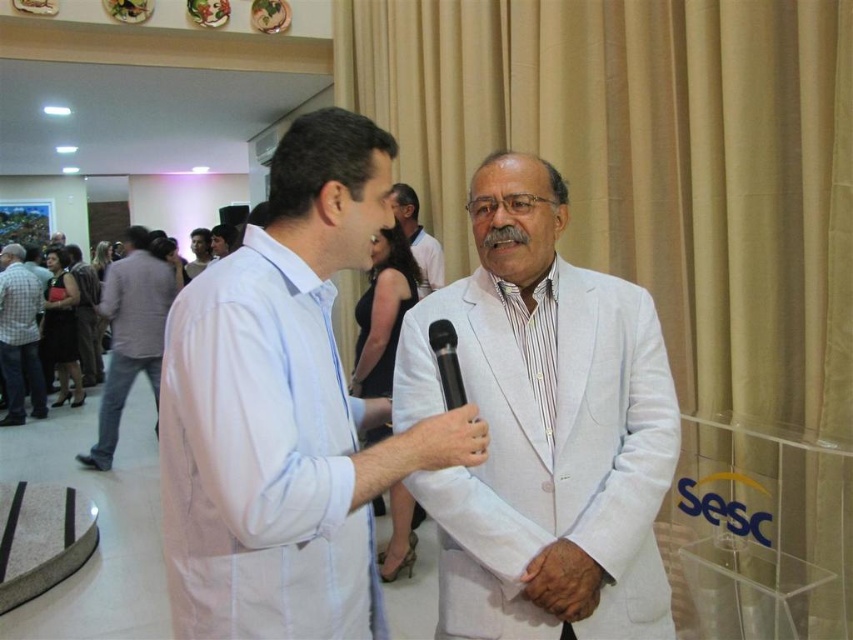
You are standing at the point with coordinates point (442, 356). You want to walk straight ahead. Will you collide with point (3, 417)?

Point (3, 417) is behind point (442, 356), so walking straight ahead from point (442, 356) will not lead you to collide with point (3, 417).

You are organizing a charity event and need to decide which clothing item to feature in the promotional material. Based on the image, which item is narrower between the white cotton shirt at center and the white linen suit at center?

The white cotton shirt at center is narrower than the white linen suit at center.

You are standing at the point marked as point (231, 547) in the image. You want to walk to the nearest exit, which is located behind the beige curtains in the background. Considering your height is 1.7 meters, will you be able to see over the man in the white suit jacket who is standing between you and the curtains? Please explain your reasoning.

The distance between you and the man in the white suit jacket at point (231, 547) is 1.14 meters. Since the man is standing between you and the curtains, and you are only 1.14 meters away from him, it would be difficult to see over him without moving closer or adjusting your position. However, your height of 1.7 meters may allow you to see over him if he is shorter than you. But without knowing his exact height, it is uncertain. However, the problem states that the point is 1.14 meters from the viewer, so